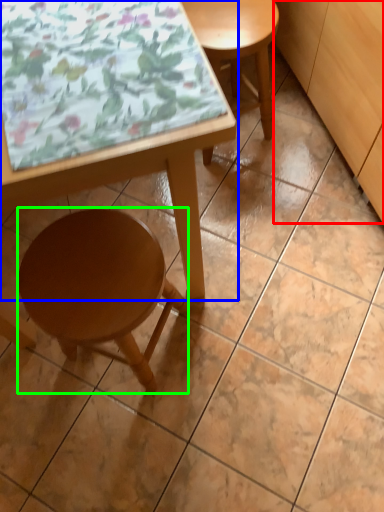
Question: Which object is positioned farthest from cabinetry (highlighted by a red box)? Select from table (highlighted by a blue box) and stool (highlighted by a green box).

Choices:
 (A) table
 (B) stool

Answer: (B)